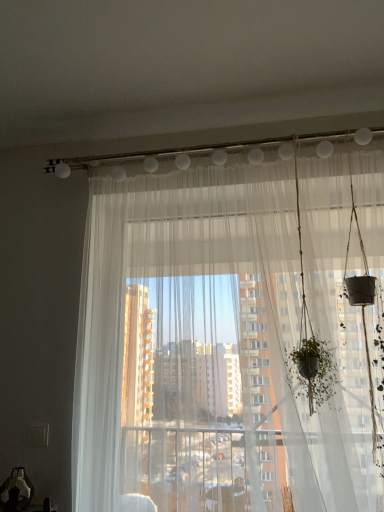
Describe the element at coordinates (233, 331) in the screenshot. I see `sheer white curtain at center` at that location.

Where is `sheer white curtain at center`? The width and height of the screenshot is (384, 512). sheer white curtain at center is located at coordinates (233, 331).

The width and height of the screenshot is (384, 512). I want to click on sheer white curtain at center, so click(x=233, y=331).